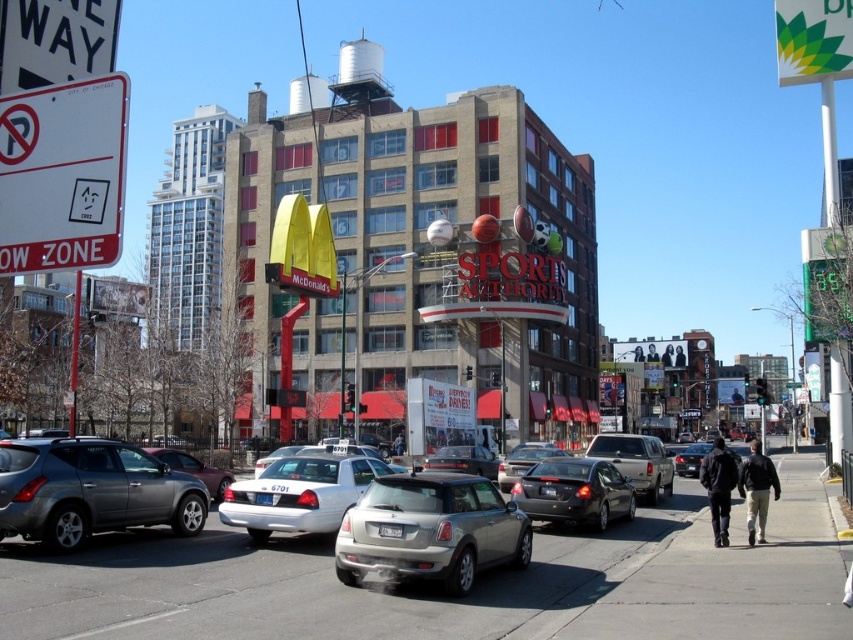
Is point (521, 554) behind point (717, 496)?

No, it is not.

Is point (410, 566) closer to camera compared to point (717, 484)?

Yes, point (410, 566) is closer to viewer.

The width and height of the screenshot is (853, 640). I want to click on satin silver car at center, so click(430, 531).

You are a GUI agent. You are given a task and a screenshot of the screen. Output one action in this format:
    pyautogui.click(x=<x>, y=<y>)
    Task: Click on the white paper sign at left
    
    Given the screenshot: What is the action you would take?
    pyautogui.click(x=62, y=176)

Can you confirm if white paper sign at left is positioned to the left of silver metallic suv at left?

No, white paper sign at left is not to the left of silver metallic suv at left.

Does point (33, 90) lie in front of point (51, 490)?

Yes.

The image size is (853, 640). Find the location of `white paper sign at left`. white paper sign at left is located at coordinates (62, 176).

How far apart are white paper sign at left and silver metallic truck at center?

white paper sign at left and silver metallic truck at center are 16.24 meters apart.

Between point (100, 147) and point (627, 433), which one is positioned behind?

Positioned behind is point (627, 433).

Is point (3, 260) positioned after point (663, 474)?

No.

Image resolution: width=853 pixels, height=640 pixels. In order to click on white paper sign at left in this screenshot , I will do `click(62, 176)`.